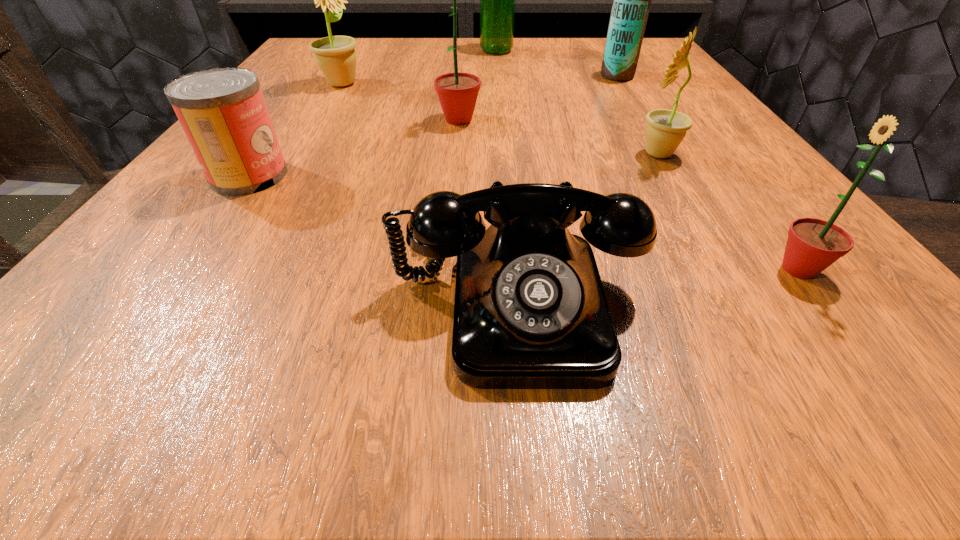
At what (x,y) coordinates should I click in order to perform the action: click on the rightmost object. Please return your answer as a coordinate pair (x, y). This screenshot has width=960, height=540. Looking at the image, I should click on (813, 244).

Find the location of a particular element. can is located at coordinates (222, 111).

Where is `telephone`? This screenshot has width=960, height=540. telephone is located at coordinates click(530, 312).

The image size is (960, 540). In order to click on vacant space located on the label of the left beer bottle in this screenshot , I will do `click(408, 51)`.

In order to click on blank area located on the label of the left beer bottle in this screenshot , I will do (429, 51).

Find the location of a particular element. The width and height of the screenshot is (960, 540). free location located on the label of the left beer bottle is located at coordinates (403, 51).

Identify the location of vacant region located on the side of the right beer bottle with the label. Image resolution: width=960 pixels, height=540 pixels. (534, 76).

Where is `free region located 0.370m on the side of the right beer bottle with the label`? This screenshot has width=960, height=540. free region located 0.370m on the side of the right beer bottle with the label is located at coordinates (423, 76).

The height and width of the screenshot is (540, 960). In order to click on free location located 0.070m on the side of the right beer bottle with the label in this screenshot , I will do `click(567, 76)`.

The width and height of the screenshot is (960, 540). Find the location of `vacant area situated 0.350m on the face of the leftmost sunflower`. vacant area situated 0.350m on the face of the leftmost sunflower is located at coordinates (539, 84).